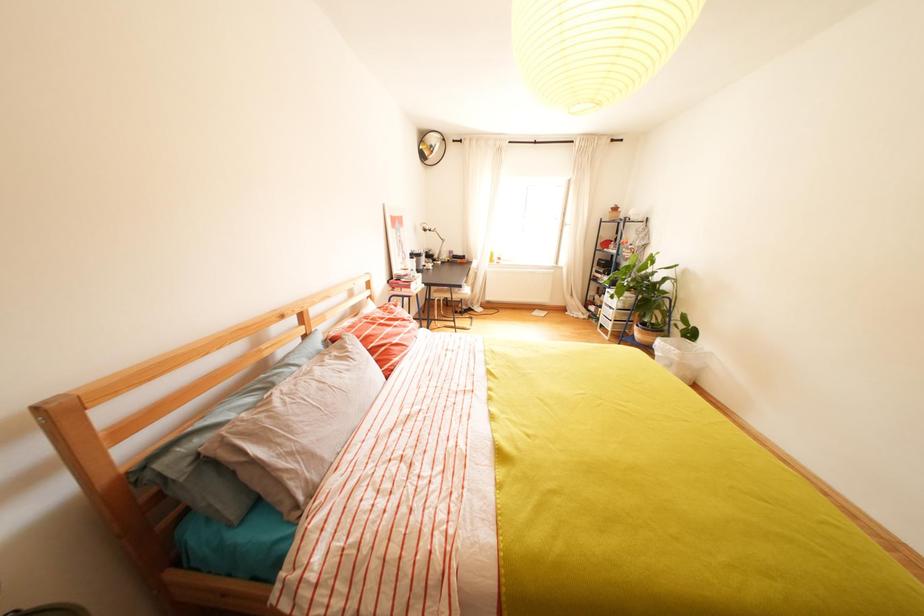
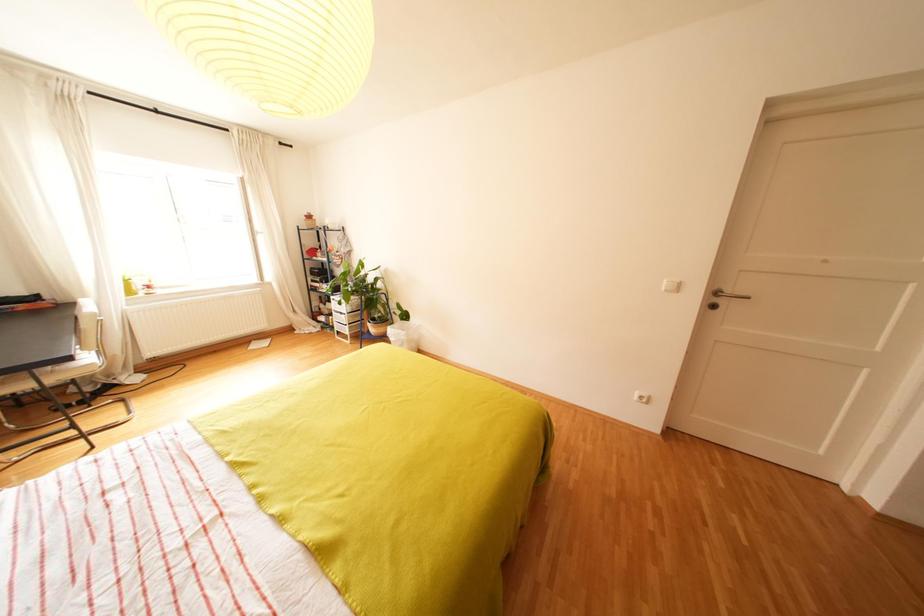
Question: The camera is either moving clockwise (left) or counter-clockwise (right) around the object. The first image is from the beginning of the video and the second image is from the end. Is the camera moving left or right when shooting the video?

Choices:
 (A) Left
 (B) Right

Answer: (A)